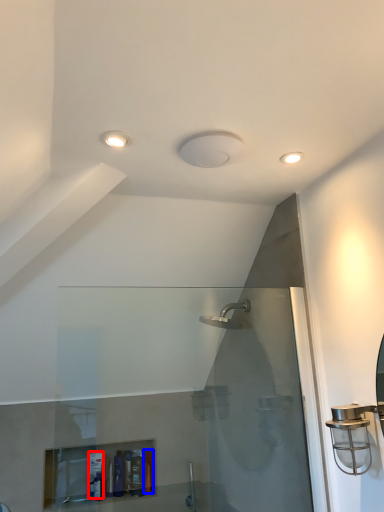
Question: Which of the following is the closest to the observer, toiletry (highlighted by a red box) or toiletry (highlighted by a blue box)?

Choices:
 (A) toiletry
 (B) toiletry

Answer: (A)